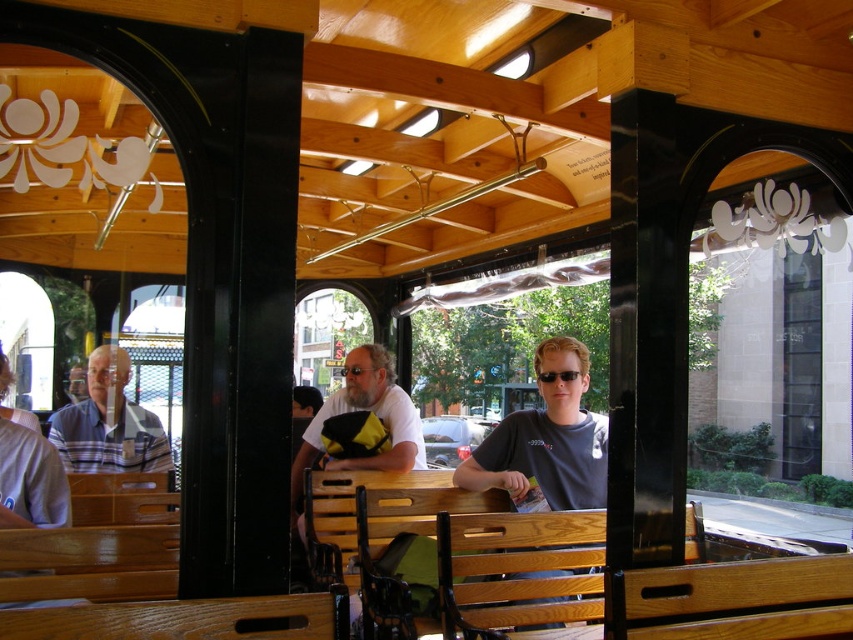
Question: Which point is farther to the camera?

Choices:
 (A) (416, 452)
 (B) (276, 605)
 (C) (140, 464)

Answer: (C)

Question: Which of the following is the closest to the observer?

Choices:
 (A) wooden table at center
 (B) matte white shirt at center

Answer: (A)

Question: Is wooden table at center below striped fabric shirt at left?

Choices:
 (A) yes
 (B) no

Answer: (A)

Question: Can you confirm if striped fabric shirt at left is thinner than matte white shirt at center?

Choices:
 (A) no
 (B) yes

Answer: (B)

Question: Which object is the closest to the matte white shirt at center?

Choices:
 (A) wooden table at center
 (B) striped fabric shirt at left

Answer: (B)

Question: Considering the relative positions of striped fabric shirt at left and matte white shirt at center in the image provided, where is striped fabric shirt at left located with respect to matte white shirt at center?

Choices:
 (A) left
 (B) right

Answer: (A)